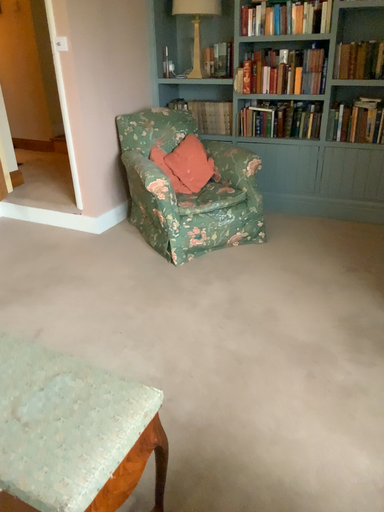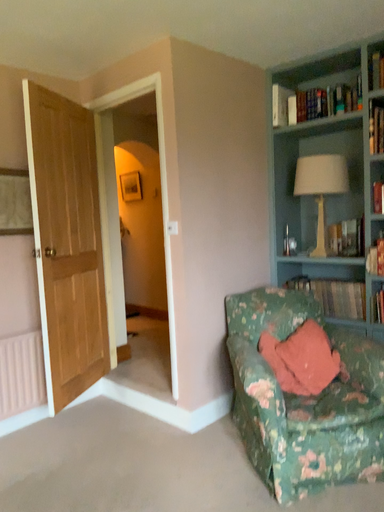
Question: Which way did the camera rotate in the video?

Choices:
 (A) rotated right
 (B) rotated left

Answer: (B)